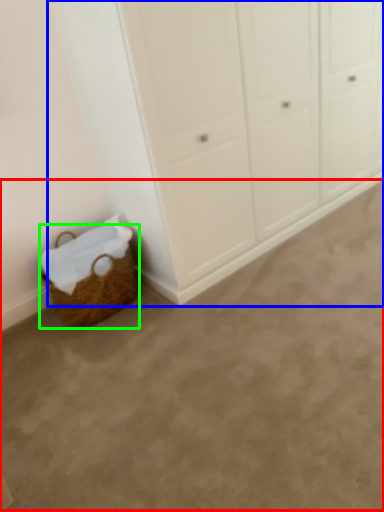
Question: Considering the real-world distances, which object is farthest from plain (highlighted by a red box)? cupboard (highlighted by a blue box) or basket (highlighted by a green box)?

Choices:
 (A) cupboard
 (B) basket

Answer: (A)